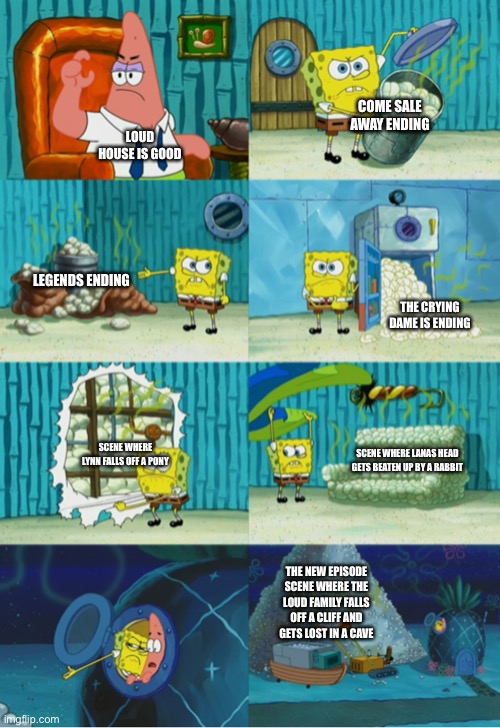
You are a GUI agent. You are given a task and a screenshot of the screen. Output one action in this format:
    pyautogui.click(x=<x>, y=<y>)
    Task: Click on the bamboo wall
    This screenshot has width=500, height=728.
    Given the screenshot: What is the action you would take?
    pyautogui.click(x=207, y=83)